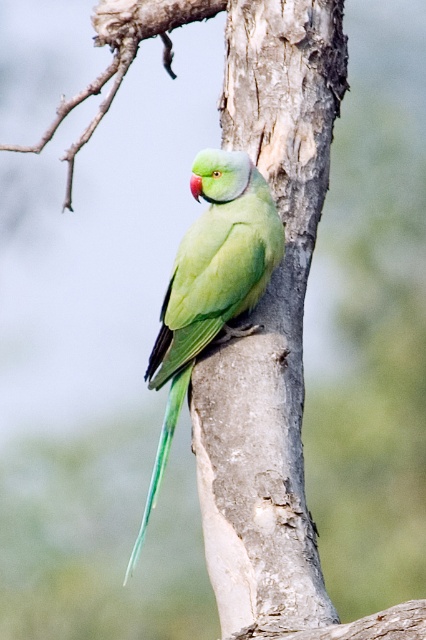
Question: Which of the following is the closest to the observer?

Choices:
 (A) (305, 83)
 (B) (152, 380)
 (C) (123, 76)

Answer: (B)

Question: Which object is the farthest from the smooth bark tree trunk at center?

Choices:
 (A) green matte parrot at center
 (B) smooth bark tree branch at upper center

Answer: (B)

Question: Which of the following is the closest to the observer?

Choices:
 (A) smooth bark tree trunk at center
 (B) smooth bark tree branch at upper center

Answer: (A)

Question: Can you confirm if green matte parrot at center is positioned to the right of smooth bark tree branch at upper center?

Choices:
 (A) yes
 (B) no

Answer: (A)

Question: Can you confirm if smooth bark tree trunk at center is bigger than green matte parrot at center?

Choices:
 (A) no
 (B) yes

Answer: (B)

Question: From the image, what is the correct spatial relationship of smooth bark tree trunk at center in relation to green matte parrot at center?

Choices:
 (A) below
 (B) above

Answer: (B)